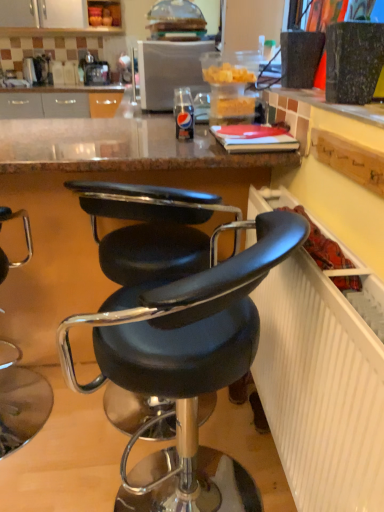
Question: In terms of width, does black leather stool at lower left, marked as the 1th chair in a left-to-right arrangement, look wider or thinner when compared to black leather chair at center, positioned as the 2th chair in left-to-right order?

Choices:
 (A) wide
 (B) thin

Answer: (A)

Question: Which is correct: black leather stool at lower left, the second chair when ordered from right to left, is inside black leather chair at center, the 1th chair in the right-to-left sequence, or outside of it?

Choices:
 (A) outside
 (B) inside

Answer: (A)

Question: Which object is positioned closest to the black leather stool at lower left, marked as the 1th chair in a left-to-right arrangement?

Choices:
 (A) satin silver microwave at upper center
 (B) black leather chair at center, positioned as the 2th chair in left-to-right order
 (C) white textured radiator at lower right

Answer: (B)

Question: Estimate the real-world distances between objects in this image. Which object is farther from the black leather chair at center, the 1th chair in the right-to-left sequence?

Choices:
 (A) white textured radiator at lower right
 (B) satin silver microwave at upper center
 (C) black leather stool at lower left, the second chair when ordered from right to left

Answer: (B)